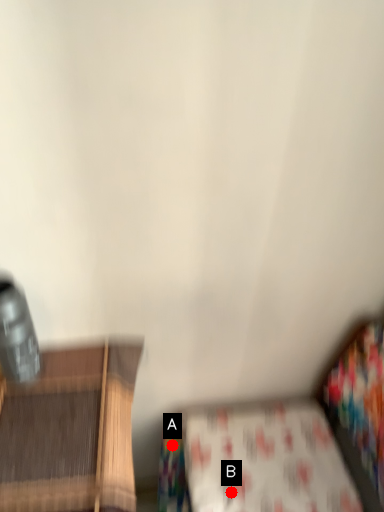
Question: Two points are circled on the image, labeled by A and B beside each circle. Among these points, which one is farthest from the camera?

Choices:
 (A) A is further
 (B) B is further

Answer: (A)